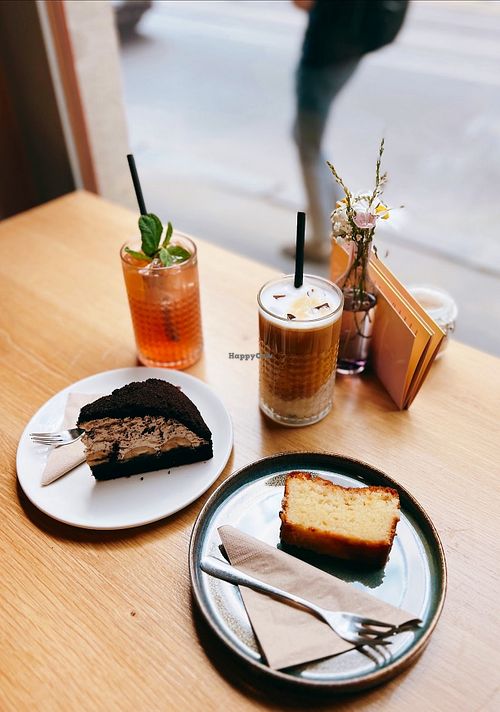
Locate an element on the screen. fork is located at coordinates (350, 626).